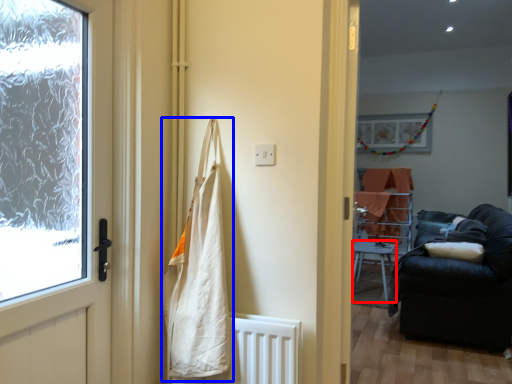
Question: Which point is closer to the camera, furniture (highlighted by a red box) or shopping bag (highlighted by a blue box)?

Choices:
 (A) furniture
 (B) shopping bag

Answer: (B)